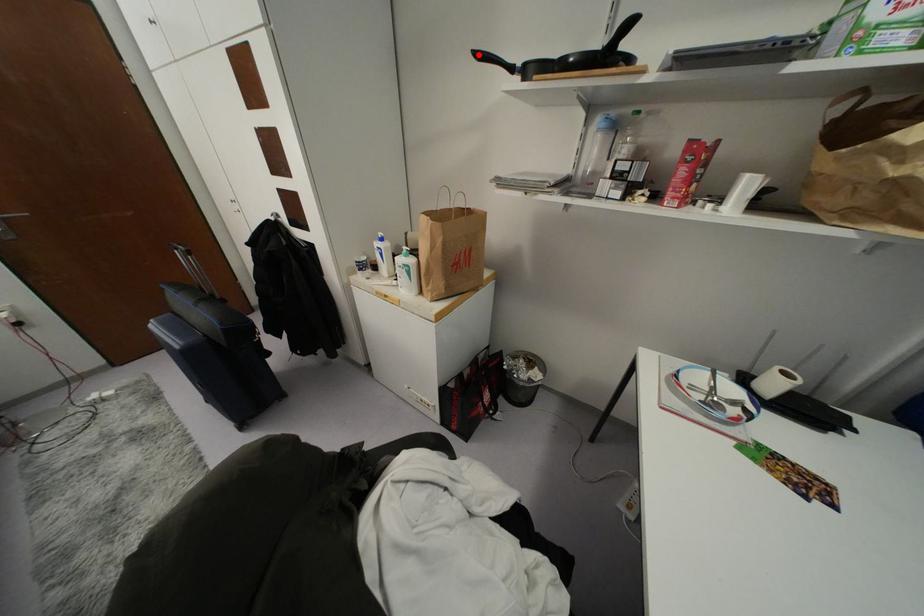
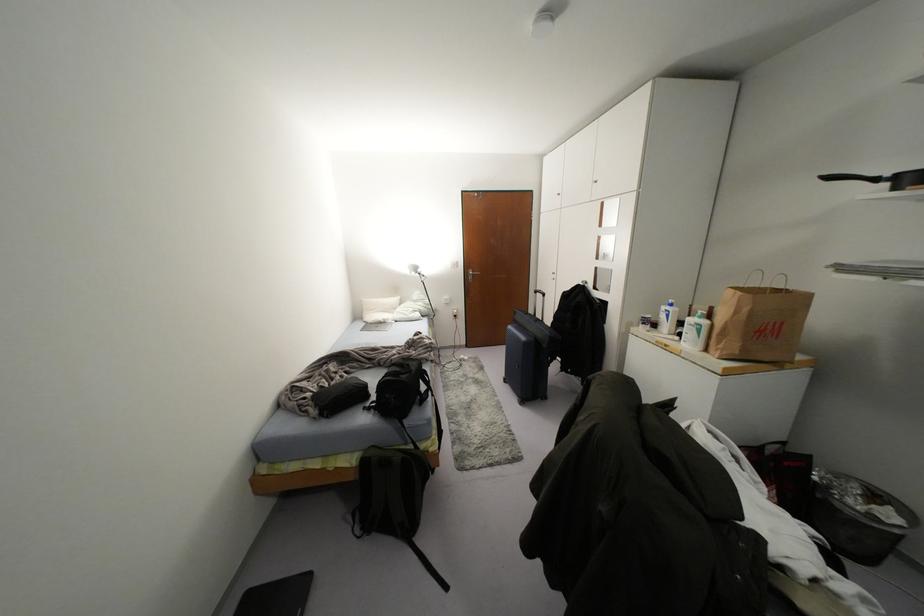
In the second image, find the point that corresponds to the highlighted location in the first image.

(829, 177)